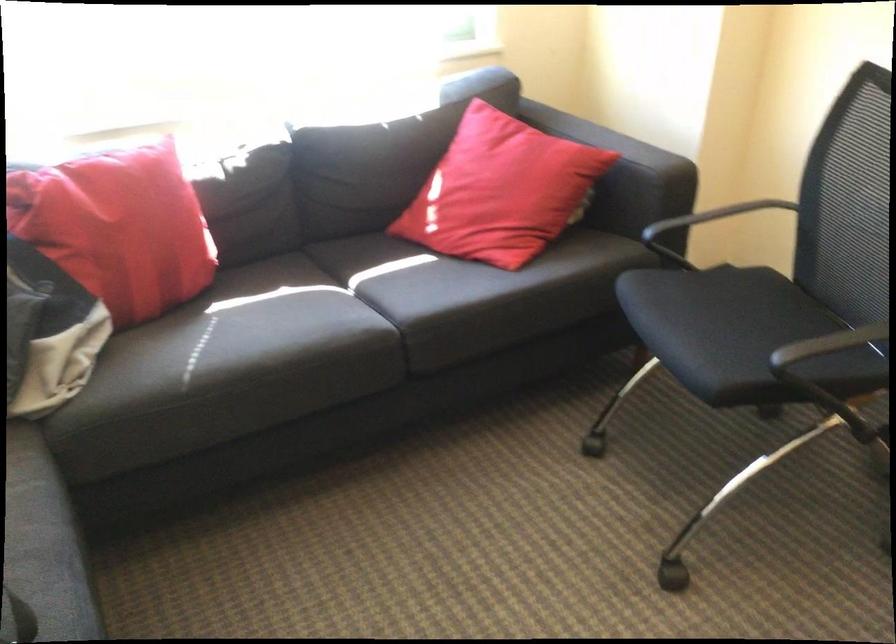
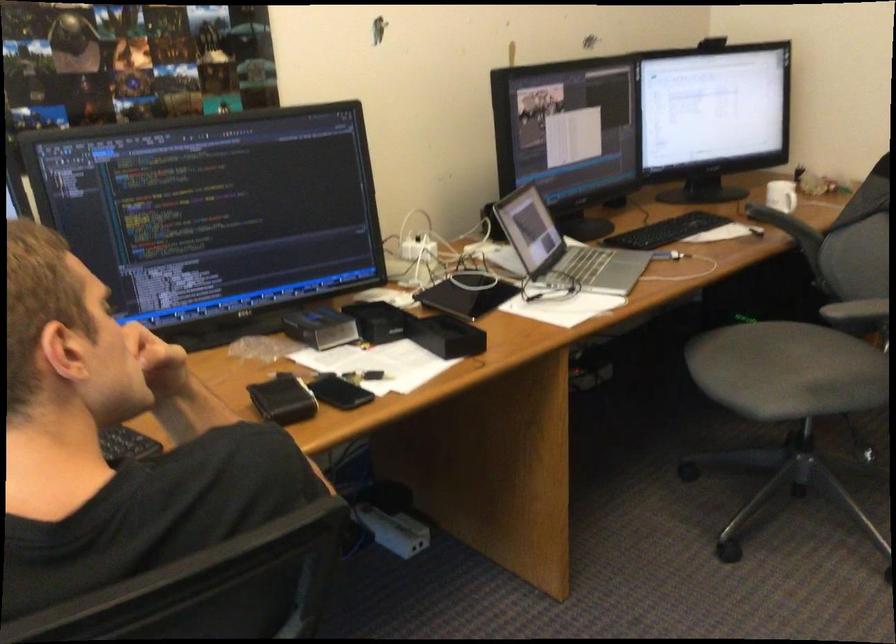
First-person continuous shooting, in which direction is the camera rotating?

The camera's rotation is toward right-down.